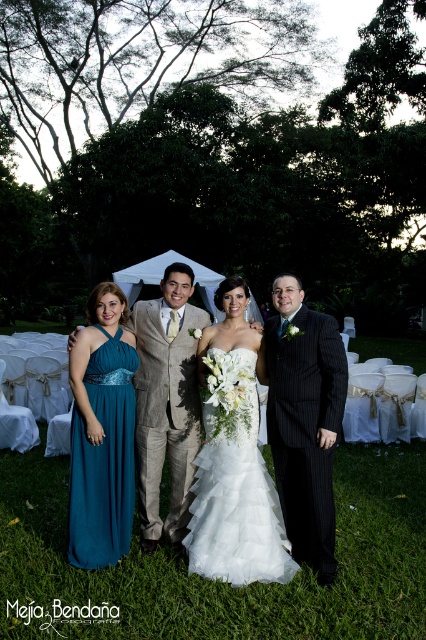
Question: Is teal satin dress at left bigger than teal chiffon dress at left?

Choices:
 (A) no
 (B) yes

Answer: (B)

Question: Which of the following is the farthest from the observer?

Choices:
 (A) white tulle dress at center
 (B) teal chiffon dress at left
 (C) pinstriped suit at center
 (D) tan textured suit at center

Answer: (D)

Question: Is teal satin dress at left positioned in front of white tulle dress at center?

Choices:
 (A) yes
 (B) no

Answer: (B)

Question: Which point is closer to the camera taking this photo?

Choices:
 (A) (331, 378)
 (B) (181, 316)
 (C) (129, 518)
 (D) (288, 324)

Answer: (A)

Question: Is pinstriped suit at center positioned before teal chiffon dress at left?

Choices:
 (A) no
 (B) yes

Answer: (B)

Question: Which object appears farthest from the camera in this image?

Choices:
 (A) teal satin dress at left
 (B) white tulle dress at center

Answer: (A)